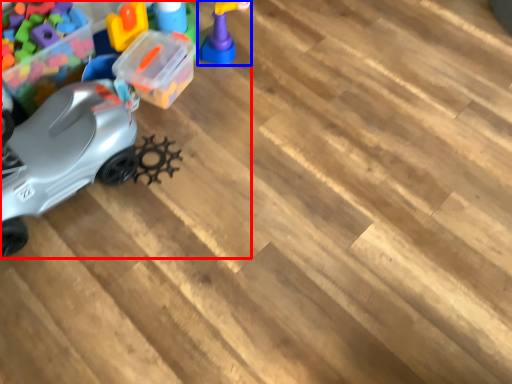
Question: Which point is further to the camera, toy (highlighted by a red box) or toy (highlighted by a blue box)?

Choices:
 (A) toy
 (B) toy

Answer: (B)